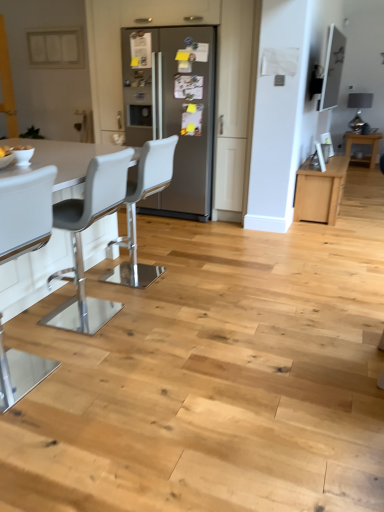
You are a GUI agent. You are given a task and a screenshot of the screen. Output one action in this format:
    pyautogui.click(x=<x>, y=<y>)
    Task: Click on the spots to the right of white plastic chair at center, marked as the first chair in a back-to-front arrangement
    
    Given the screenshot: What is the action you would take?
    pyautogui.click(x=193, y=276)